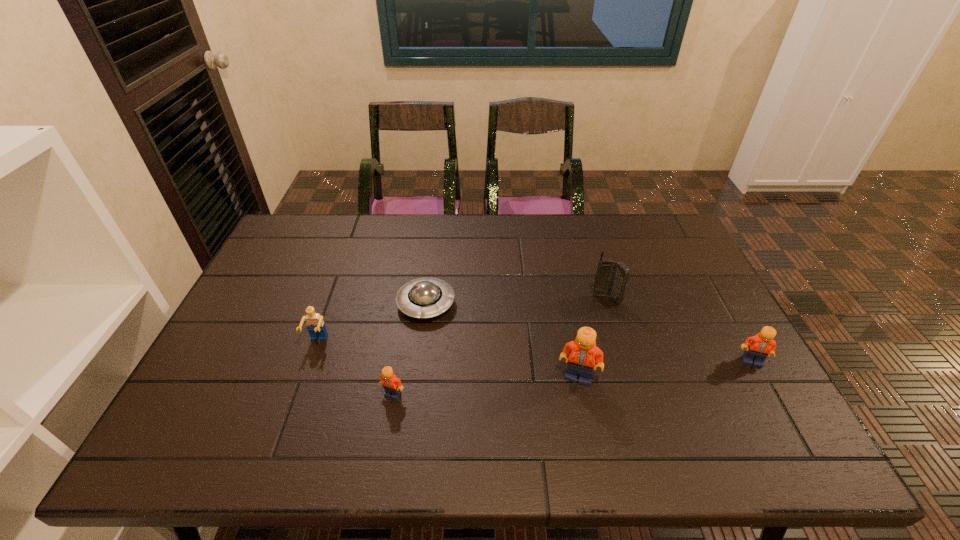
Given the evenly spaced Legos in the image, where should an extra Lego be added on the left to preserve the spacing? Please point to a vacant space. Please provide its 2D coordinates. Your answer should be formatted as a tuple, i.e. [(x, y)], where the tuple contains the x and y coordinates of a point satisfying the conditions above.

[(195, 412)]